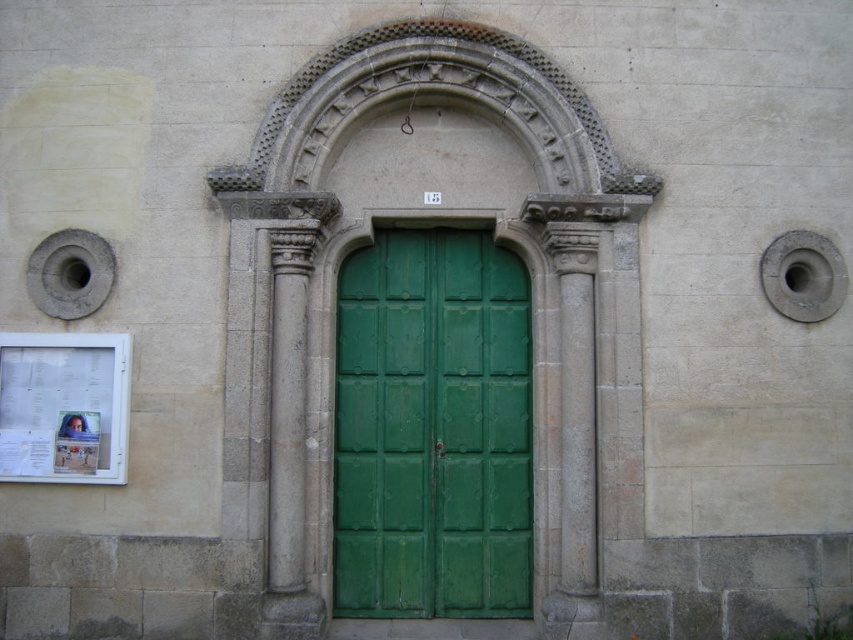
Is green wooden door at center taller than gray stone column at center?

Correct, green wooden door at center is much taller as gray stone column at center.

Which of these two, green wooden door at center or gray stone column at center, stands shorter?

Standing shorter between the two is gray stone column at center.

Describe the element at coordinates (432, 428) in the screenshot. I see `green wooden door at center` at that location.

This screenshot has height=640, width=853. What are the coordinates of `green wooden door at center` in the screenshot? It's located at (432, 428).